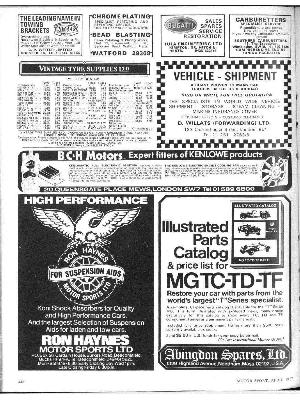
Find the location of a particular element. checkerboard border is located at coordinates 158,115, 207,141, 287,101, 230,64.